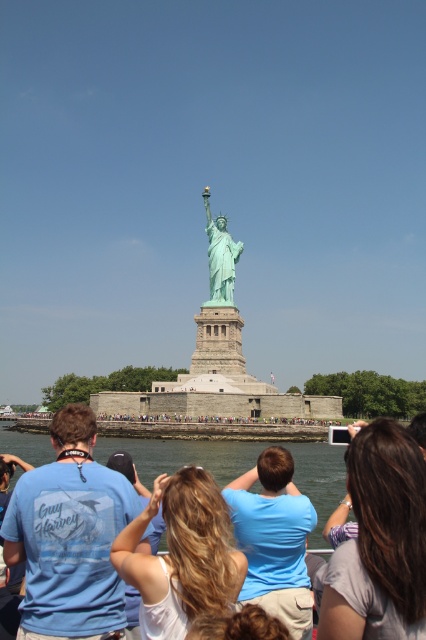
You are a photographer trying to capture the gray fabric shirt at lower right and the green patina statue at center in the same frame. Which object is wider in the image?

The gray fabric shirt at lower right is wider than the green patina statue at center in the image.

You are a photographer trying to capture the green patina statue at center and the white matte hair at center in the same frame. Based on their positions, which object should you focus on first to ensure both are in the shot?

The white matte hair at center is located below the green patina statue at center, so you should focus on the green patina statue at center first to ensure both are in the shot.